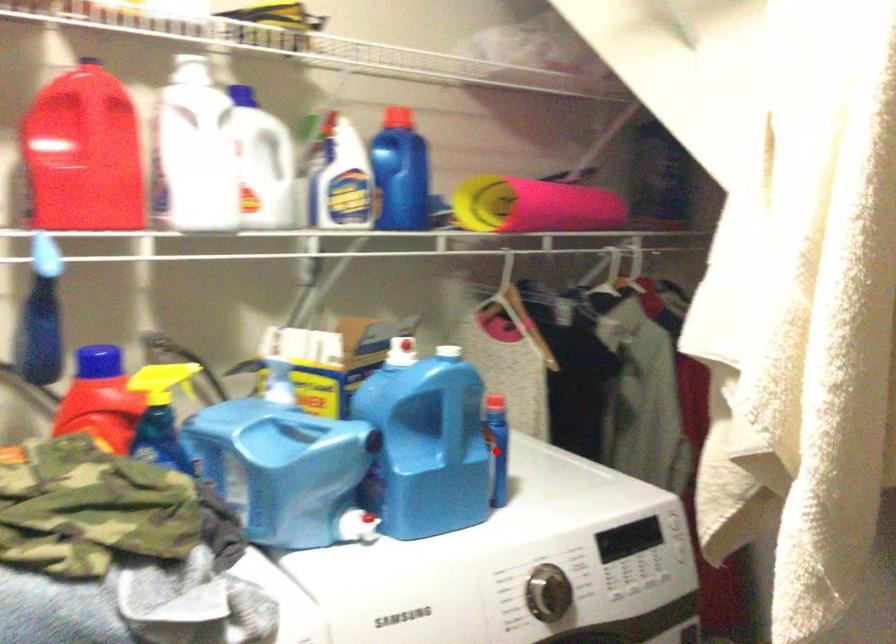
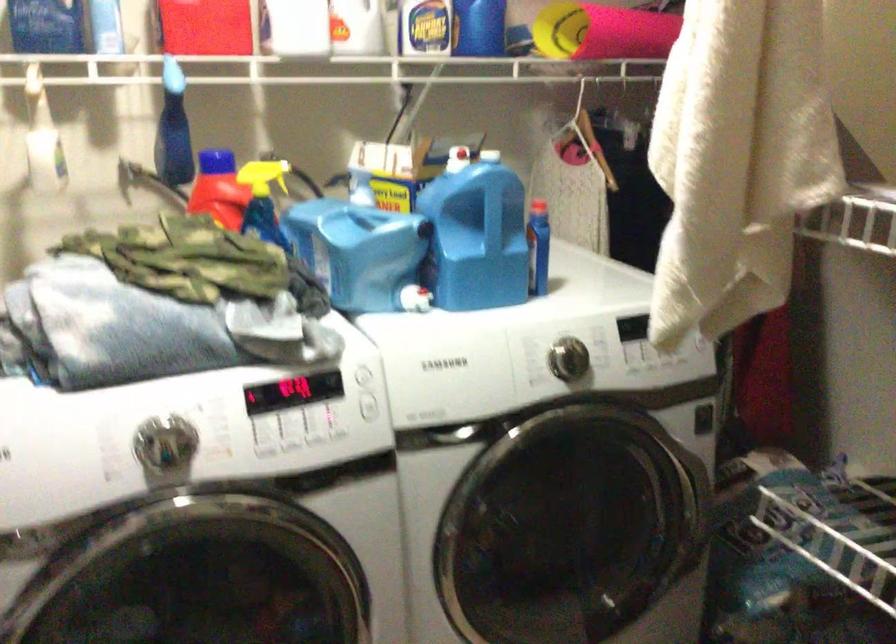
Find the pixel in the second image that matches the highlighted location in the first image.

(538, 247)